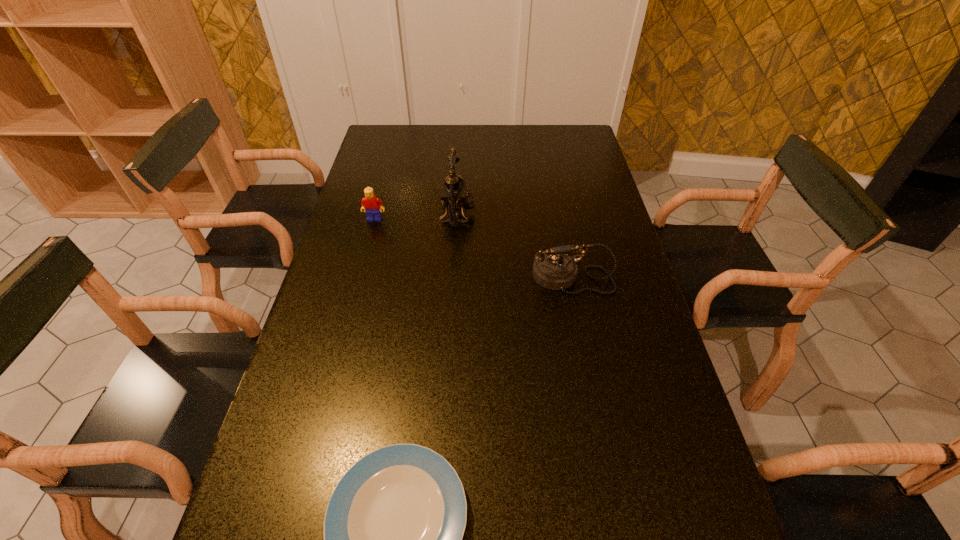
The height and width of the screenshot is (540, 960). In order to click on the tallest object in this screenshot , I will do `click(454, 195)`.

The width and height of the screenshot is (960, 540). I want to click on the taller telephone, so click(454, 195).

Identify the location of the nearer telephone. Image resolution: width=960 pixels, height=540 pixels. (553, 269).

The image size is (960, 540). Find the location of `the second nearest object`. the second nearest object is located at coordinates (553, 269).

The height and width of the screenshot is (540, 960). Identify the location of Lego. (370, 204).

The height and width of the screenshot is (540, 960). Identify the location of free spot located on the rotary dial of the left telephone. (562, 214).

Image resolution: width=960 pixels, height=540 pixels. Find the location of `vacant space located 0.100m on the left of the second nearest object`. vacant space located 0.100m on the left of the second nearest object is located at coordinates (494, 277).

You are a GUI agent. You are given a task and a screenshot of the screen. Output one action in this format:
    pyautogui.click(x=<x>, y=<y>)
    Task: Click on the vacant space located on the face of the leftmost object
    This screenshot has width=960, height=540.
    Given the screenshot: What is the action you would take?
    pyautogui.click(x=353, y=301)

Identify the location of object positioned at the left edge. (370, 204).

You are a GUI agent. You are given a task and a screenshot of the screen. Output one action in this format:
    pyautogui.click(x=<x>, y=<y>)
    Task: Click on the object present at the right edge
    The image size is (960, 540).
    Given the screenshot: What is the action you would take?
    pyautogui.click(x=553, y=269)